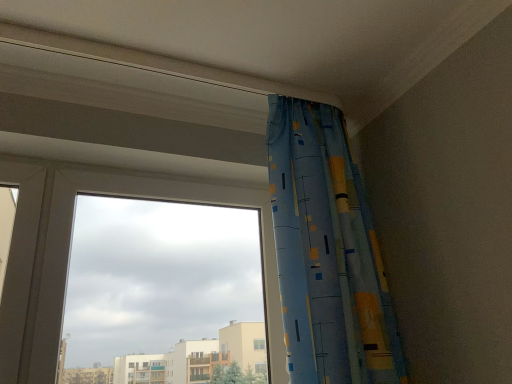
The height and width of the screenshot is (384, 512). What do you see at coordinates (139, 197) in the screenshot?
I see `transparent glass window at upper left` at bounding box center [139, 197].

In order to face transparent glass window at upper left, should I rotate leftwards or rightwards?

You should rotate left by 13.906 degrees.

Locate an element on the screen. The width and height of the screenshot is (512, 384). transparent glass window at upper left is located at coordinates (139, 197).

What is the approximate width of blue printed fabric curtain at upper right?

blue printed fabric curtain at upper right is 10.93 inches wide.

This screenshot has width=512, height=384. Identify the location of blue printed fabric curtain at upper right. (327, 253).

Measure the distance between point (339, 310) and camera.

They are 3.89 feet apart.

What do you see at coordinates (327, 253) in the screenshot? Image resolution: width=512 pixels, height=384 pixels. I see `blue printed fabric curtain at upper right` at bounding box center [327, 253].

Locate an element on the screen. The image size is (512, 384). transparent glass window at upper left is located at coordinates (139, 197).

Which object is positioned more to the right, transparent glass window at upper left or blue printed fabric curtain at upper right?

Positioned to the right is blue printed fabric curtain at upper right.

Which is in front, transparent glass window at upper left or blue printed fabric curtain at upper right?

blue printed fabric curtain at upper right is more forward.

Which is in front, point (156, 176) or point (304, 370)?

The point (304, 370) is closer.

From the image's perspective, which object appears higher, transparent glass window at upper left or blue printed fabric curtain at upper right?

blue printed fabric curtain at upper right is shown above in the image.

Looking at this image, from a real-world perspective, which object stands above the other?

blue printed fabric curtain at upper right.

Looking at their sizes, would you say transparent glass window at upper left is wider or thinner than blue printed fabric curtain at upper right?

Considering their sizes, transparent glass window at upper left looks slimmer than blue printed fabric curtain at upper right.

Considering the sizes of transparent glass window at upper left and blue printed fabric curtain at upper right in the image, is transparent glass window at upper left taller or shorter than blue printed fabric curtain at upper right?

Considering their sizes, transparent glass window at upper left has less height than blue printed fabric curtain at upper right.

Can you confirm if transparent glass window at upper left is smaller than blue printed fabric curtain at upper right?

Yes, transparent glass window at upper left is smaller than blue printed fabric curtain at upper right.

Is blue printed fabric curtain at upper right completely or partially inside transparent glass window at upper left?

No, blue printed fabric curtain at upper right is not a part of transparent glass window at upper left.

Is transparent glass window at upper left placed right next to blue printed fabric curtain at upper right?

No, transparent glass window at upper left is not beside blue printed fabric curtain at upper right.

Is transparent glass window at upper left aimed at blue printed fabric curtain at upper right?

Yes, transparent glass window at upper left is turned towards blue printed fabric curtain at upper right.

How many degrees apart are the facing directions of transparent glass window at upper left and blue printed fabric curtain at upper right?

transparent glass window at upper left and blue printed fabric curtain at upper right are facing 0.00234 degrees away from each other.

In order to click on window directly beneath the blue printed fabric curtain at upper right (from a real-world perspective) in this screenshot , I will do `click(139, 197)`.

Between blue printed fabric curtain at upper right and transparent glass window at upper left, which one appears on the right side from the viewer's perspective?

Positioned to the right is blue printed fabric curtain at upper right.

Which object is closer to the camera, blue printed fabric curtain at upper right or transparent glass window at upper left?

blue printed fabric curtain at upper right is more forward.

Considering the points (308, 381) and (166, 193), which point is behind, point (308, 381) or point (166, 193)?

Positioned behind is point (166, 193).

From the image's perspective, which is above, blue printed fabric curtain at upper right or transparent glass window at upper left?

From the image's view, blue printed fabric curtain at upper right is above.

From a real-world perspective, is blue printed fabric curtain at upper right physically above transparent glass window at upper left?

Correct, in the physical world, blue printed fabric curtain at upper right is higher than transparent glass window at upper left.

Consider the image. Between blue printed fabric curtain at upper right and transparent glass window at upper left, which one has smaller width?

transparent glass window at upper left is thinner.

Is blue printed fabric curtain at upper right taller or shorter than transparent glass window at upper left?

blue printed fabric curtain at upper right is taller than transparent glass window at upper left.

Can you confirm if blue printed fabric curtain at upper right is smaller than transparent glass window at upper left?

No.

Is transparent glass window at upper left located within blue printed fabric curtain at upper right?

No, transparent glass window at upper left is not a part of blue printed fabric curtain at upper right.

Is there a large distance between blue printed fabric curtain at upper right and transparent glass window at upper left?

blue printed fabric curtain at upper right is actually quite close to transparent glass window at upper left.

Is blue printed fabric curtain at upper right facing towards transparent glass window at upper left?

No, blue printed fabric curtain at upper right is not turned towards transparent glass window at upper left.

How many degrees apart are the facing directions of blue printed fabric curtain at upper right and transparent glass window at upper left?

They differ by 0.00234 degrees in their facing directions.

Measure the distance between blue printed fabric curtain at upper right and transparent glass window at upper left.

blue printed fabric curtain at upper right and transparent glass window at upper left are 13.92 inches apart.

Where is `window behind the blue printed fabric curtain at upper right`? window behind the blue printed fabric curtain at upper right is located at coordinates (139, 197).

Where is `curtain on the right of transparent glass window at upper left`? curtain on the right of transparent glass window at upper left is located at coordinates (327, 253).

The width and height of the screenshot is (512, 384). Identify the location of curtain above the transparent glass window at upper left (from the image's perspective). (327, 253).